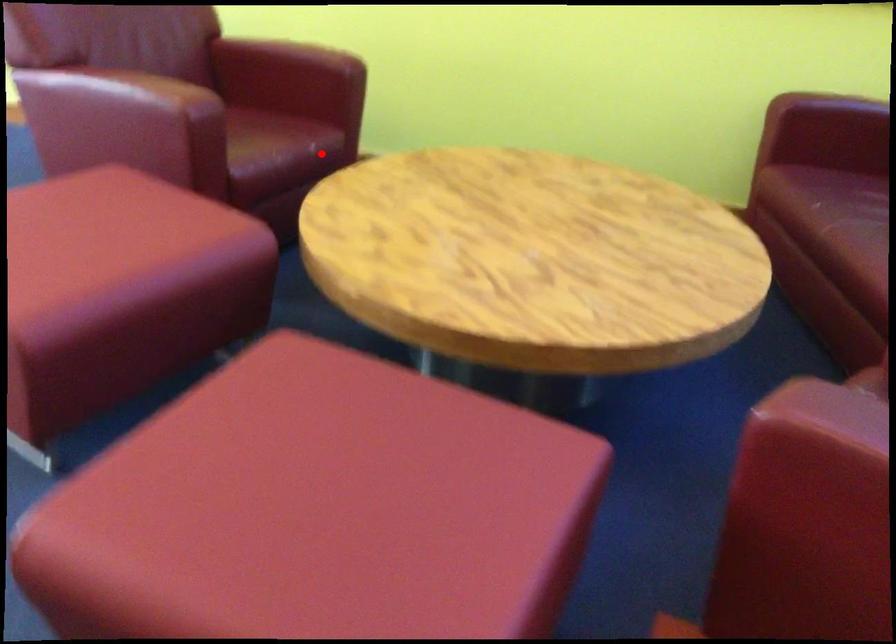
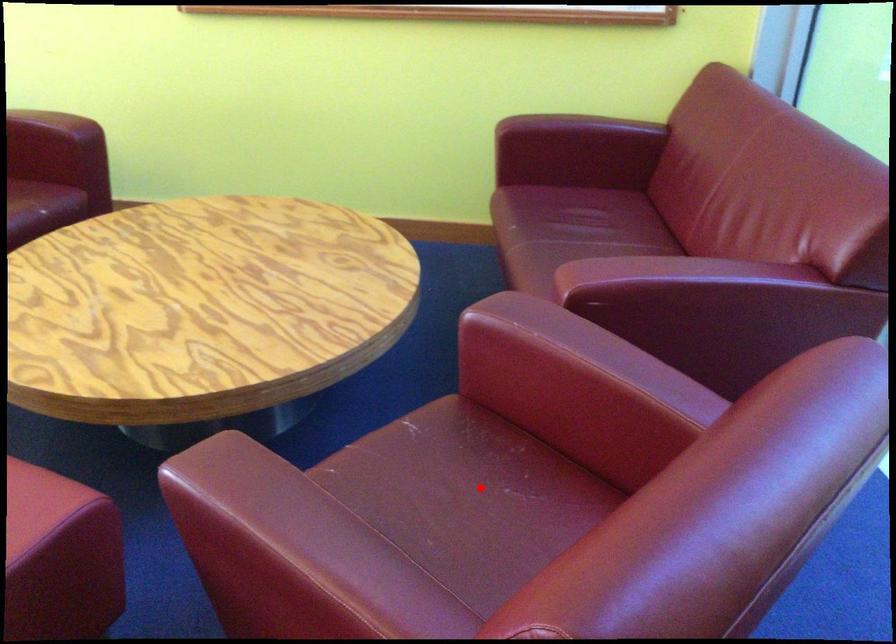
I am providing you with two images of the same scene from different viewpoints. A red point is marked on the first image and another point is marked on the second image. Is the red point in image1 aligned with the point shown in image2?

No